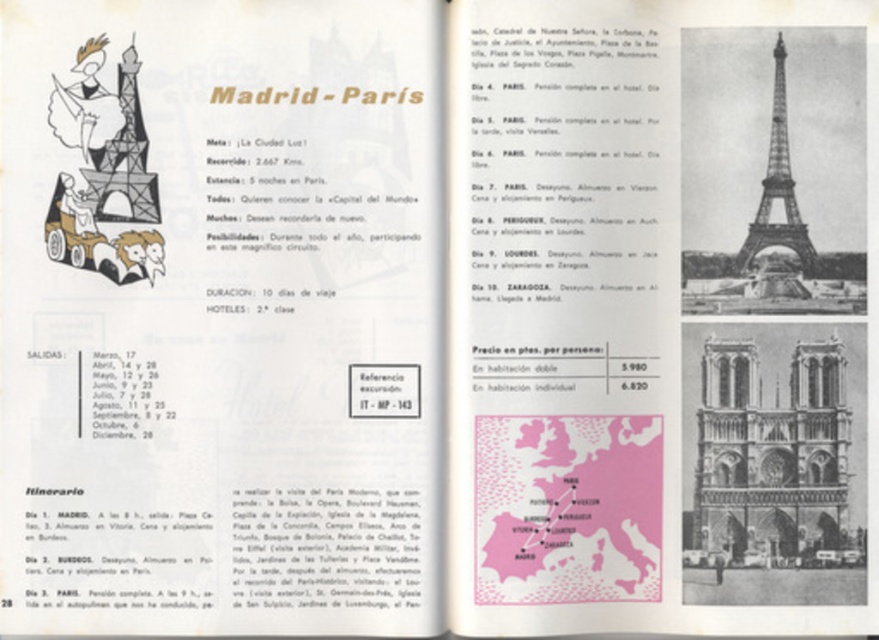
You are looking at a travel brochure page. On the right side, there are two black and white photos. The first photo shows the metallic silver eiffel tower at upper right, and the second photo shows the stone gothic cathedral at lower right. From the perspective of someone reading the brochure, which photo is positioned to the left of the other?

The stone gothic cathedral at lower right is to the left of the metallic silver eiffel tower at upper right.

You are planning a trip to Paris and need to decide which landmark to visit first based on their sizes. According to the brochure image, which one is larger between the stone gothic cathedral at lower right and the metallic silver eiffel tower at upper right?

The stone gothic cathedral at lower right is bigger than the metallic silver eiffel tower at upper right, so you should visit the stone gothic cathedral at lower right first if you want to see the larger landmark.